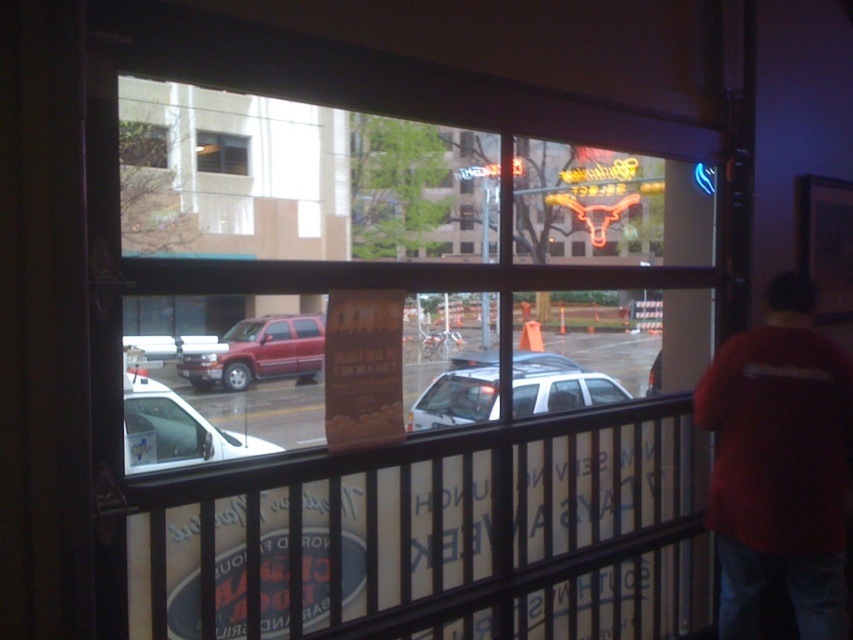
Question: In this image, where is white matte suv at center located relative to metallic red truck at center?

Choices:
 (A) above
 (B) below

Answer: (B)

Question: Among these points, which one is farthest from the camera?

Choices:
 (A) (438, 186)
 (B) (213, 360)
 (C) (840, 557)
 (D) (437, 378)

Answer: (A)

Question: Among these points, which one is nearest to the camera?

Choices:
 (A) (433, 182)
 (B) (445, 412)
 (C) (436, 545)

Answer: (C)

Question: Which point is farther to the camera?

Choices:
 (A) white matte van at lower left
 (B) clear glass window at upper left
 (C) red cotton shirt at right

Answer: (A)

Question: Is clear glass fence at lower center smaller than clear glass window at upper left?

Choices:
 (A) no
 (B) yes

Answer: (B)

Question: Does red cotton shirt at right have a greater width compared to clear glass window at upper center?

Choices:
 (A) yes
 (B) no

Answer: (B)